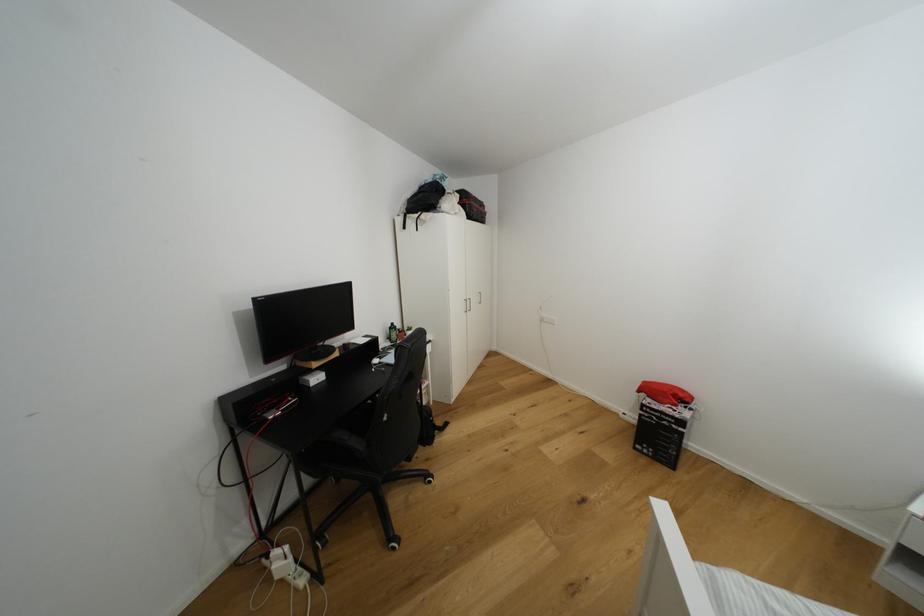
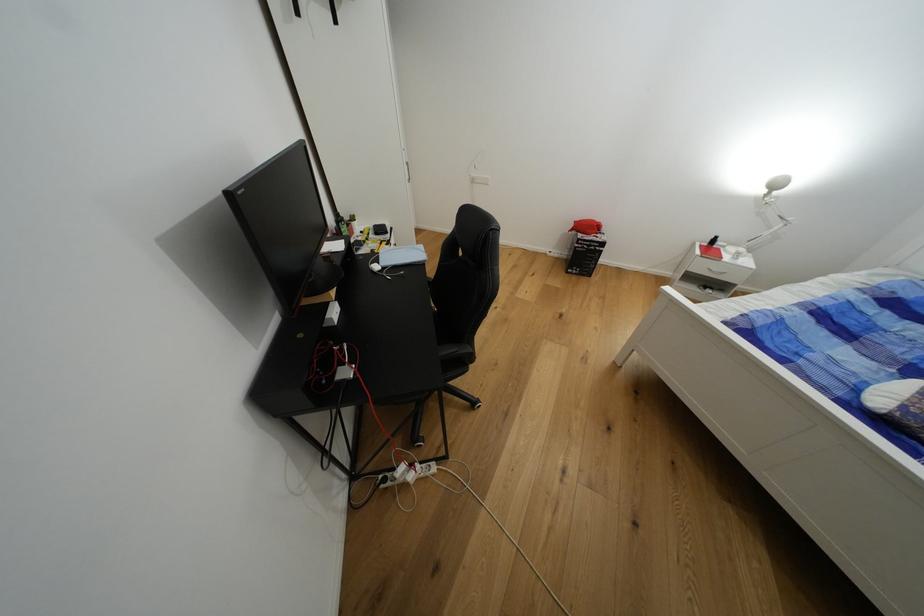
The point at (643, 392) is marked in the first image. Where is the corresponding point in the second image?

(576, 232)